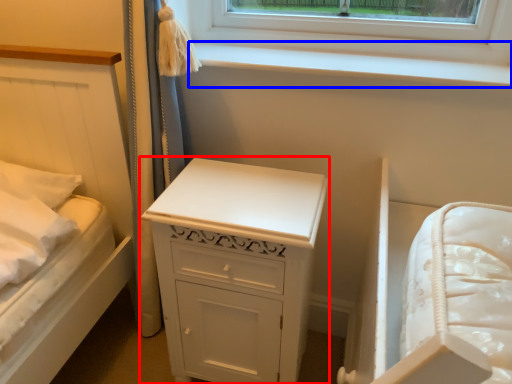
Question: Which object is closer to the camera taking this photo, chest of drawers (highlighted by a red box) or window sill (highlighted by a blue box)?

Choices:
 (A) chest of drawers
 (B) window sill

Answer: (A)